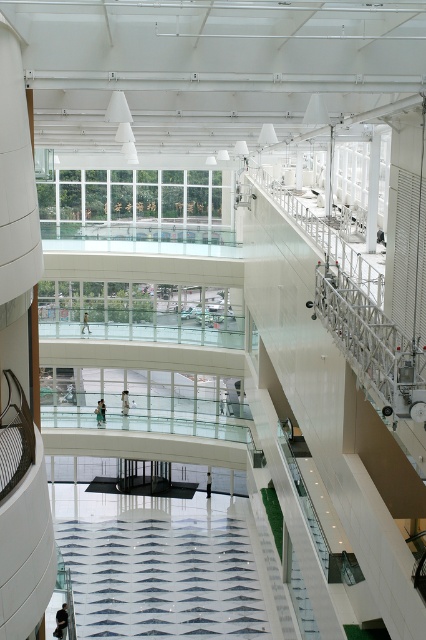
Question: Does white textured fabric at center appear over light brown leather jacket at lower center?

Choices:
 (A) yes
 (B) no

Answer: (B)

Question: Which point is farther from the camera taking this photo?

Choices:
 (A) (83, 332)
 (B) (23, 333)
 (C) (66, 627)

Answer: (A)

Question: Is dark blue fabric jacket at lower left behind light blue fabric person at center?

Choices:
 (A) no
 (B) yes

Answer: (A)

Question: Which point is closer to the camera taking this photo?

Choices:
 (A) (123, 396)
 (B) (209, 483)
 (C) (6, 348)
 (D) (192, 621)

Answer: (C)

Question: Can you confirm if dark blue fabric jacket at lower left is positioned to the right of light brown wooden person at center?

Choices:
 (A) yes
 (B) no

Answer: (A)

Question: Based on their relative distances, which object is farther from the light blue fabric person at center?

Choices:
 (A) white glossy pillar at left
 (B) dark blue fabric jacket at lower left

Answer: (A)